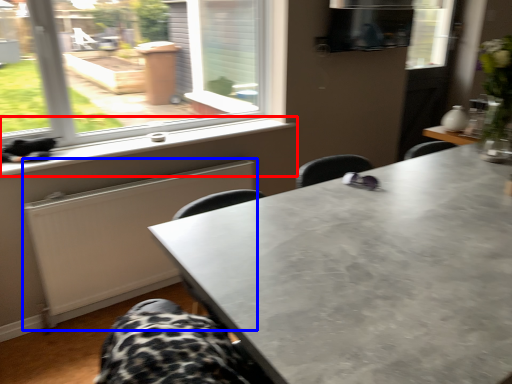
Question: Which object is further to the camera taking this photo, window sill (highlighted by a red box) or radiator (highlighted by a blue box)?

Choices:
 (A) window sill
 (B) radiator

Answer: (B)